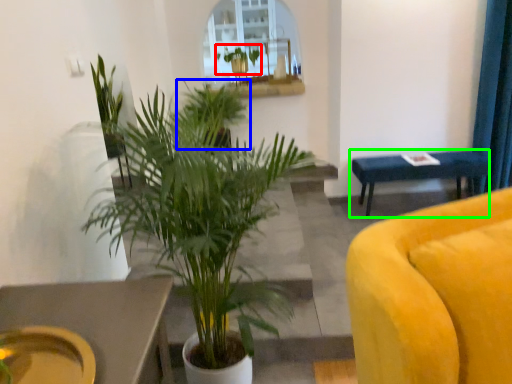
Question: Estimate the real-world distances between objects in this image. Which object is closer to houseplant (highlighted by a red box), houseplant (highlighted by a blue box) or table (highlighted by a green box)?

Choices:
 (A) houseplant
 (B) table

Answer: (A)